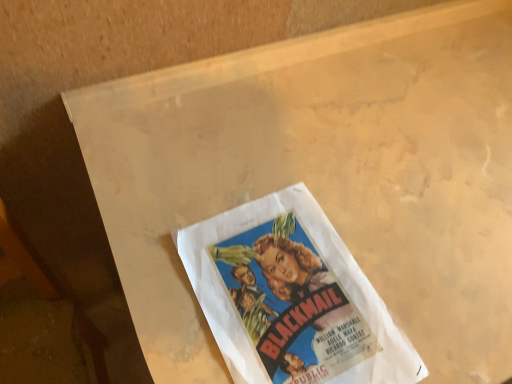
Identify the location of free region on the left part of matte paper poster at center. (155, 245).